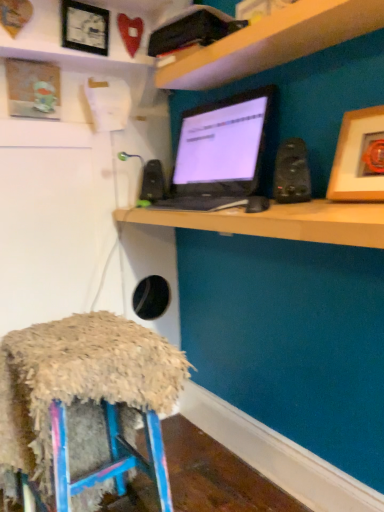
Identify the location of black glossy monitor at center. (279, 221).

This screenshot has height=512, width=384. Describe the element at coordinates (272, 42) in the screenshot. I see `wooden shelf at upper center` at that location.

Identify the location of wooden shelf at upper center. (272, 42).

Image resolution: width=384 pixels, height=512 pixels. What do you see at coordinates (220, 153) in the screenshot? I see `black glossy laptop at center` at bounding box center [220, 153].

The image size is (384, 512). What are the coordinates of `wooden framed picture at upper left, the 2th picture frame from the left` in the screenshot? It's located at (85, 27).

Does point (367, 141) come behind point (157, 183)?

No.

From the picture: Can you confirm if wooden picture frame at upper right, the 1th picture frame in the right-to-left sequence, is positioned to the right of black matte speaker at center, arranged as the first speaker when viewed from the back?

Correct, you'll find wooden picture frame at upper right, the 1th picture frame in the right-to-left sequence, to the right of black matte speaker at center, arranged as the first speaker when viewed from the back.

From the picture: Is wooden picture frame at upper right, which is the third picture frame from back to front, oriented towards black matte speaker at center, marked as the 1th speaker in a left-to-right arrangement?

No, wooden picture frame at upper right, which is the third picture frame from back to front, is not aimed at black matte speaker at center, marked as the 1th speaker in a left-to-right arrangement.

Is the depth of wooden picture frame at upper right, the 1th picture frame in the right-to-left sequence, greater than that of black matte speaker at center, arranged as the first speaker when viewed from the back?

No, wooden picture frame at upper right, the 1th picture frame in the right-to-left sequence, is in front of black matte speaker at center, arranged as the first speaker when viewed from the back.

From a real-world perspective, who is located higher, black plastic speaker at upper right, which ranks as the first speaker in front-to-back order, or matte green frame at upper left, the 1th picture frame from the back?

matte green frame at upper left, the 1th picture frame from the back, is physically above.

Is black plastic speaker at upper right, which ranks as the first speaker in front-to-back order, at the left side of matte green frame at upper left, the 2th picture frame when ordered from top to bottom?

In fact, black plastic speaker at upper right, which ranks as the first speaker in front-to-back order, is to the right of matte green frame at upper left, the 2th picture frame when ordered from top to bottom.

Between black plastic speaker at upper right, the 2th speaker when ordered from back to front, and matte green frame at upper left, marked as the first picture frame in a left-to-right arrangement, which one has larger size?

With larger size is matte green frame at upper left, marked as the first picture frame in a left-to-right arrangement.

Looking at this image, is wooden picture frame at upper right, the first picture frame positioned from the front, at the left side of black plastic speaker at upper right, the first speaker positioned from the right?

Incorrect, wooden picture frame at upper right, the first picture frame positioned from the front, is not on the left side of black plastic speaker at upper right, the first speaker positioned from the right.

From the image's perspective, which one is positioned lower, wooden picture frame at upper right, the 1th picture frame in the right-to-left sequence, or black plastic speaker at upper right, marked as the 2th speaker in a left-to-right arrangement?

black plastic speaker at upper right, marked as the 2th speaker in a left-to-right arrangement, is shown below in the image.

Is wooden picture frame at upper right, which is the first picture frame in bottom-to-top order, not close to black plastic speaker at upper right, which ranks as the first speaker in front-to-back order?

wooden picture frame at upper right, which is the first picture frame in bottom-to-top order, is actually quite close to black plastic speaker at upper right, which ranks as the first speaker in front-to-back order.

Can we say wooden picture frame at upper right, the first picture frame positioned from the front, lies outside black plastic speaker at upper right, which ranks as the first speaker in front-to-back order?

Yes.

From a real-world perspective, is wooden shelf at upper center physically located above or below matte green frame at upper left, the 1th picture frame from the back?

wooden shelf at upper center is situated higher than matte green frame at upper left, the 1th picture frame from the back, in the real world.

Is wooden shelf at upper center positioned with its back to matte green frame at upper left, marked as the first picture frame in a left-to-right arrangement?

No, wooden shelf at upper center is not facing away from matte green frame at upper left, marked as the first picture frame in a left-to-right arrangement.

Who is more distant, wooden shelf at upper center or matte green frame at upper left, the 2th picture frame when ordered from top to bottom?

Positioned behind is matte green frame at upper left, the 2th picture frame when ordered from top to bottom.

Is wooden shelf at upper center in contact with matte green frame at upper left, the 2th picture frame ordered from the bottom?

No, wooden shelf at upper center is not touching matte green frame at upper left, the 2th picture frame ordered from the bottom.

Which point is more forward, (150, 170) or (21, 81)?

The point (21, 81) is closer to the camera.

Is black matte speaker at center, which is the second speaker from front to back, in front of or behind matte green frame at upper left, the 2th picture frame when ordered from top to bottom, in the image?

black matte speaker at center, which is the second speaker from front to back, is positioned farther from the viewer than matte green frame at upper left, the 2th picture frame when ordered from top to bottom.

From their relative heights in the image, would you say black matte speaker at center, which is the second speaker from front to back, is taller or shorter than matte green frame at upper left, positioned as the third picture frame in right-to-left order?

In the image, black matte speaker at center, which is the second speaker from front to back, appears to be shorter than matte green frame at upper left, positioned as the third picture frame in right-to-left order.

Is black matte speaker at center, which is the second speaker from front to back, next to matte green frame at upper left, marked as the third picture frame in a front-to-back arrangement, and touching it?

No, black matte speaker at center, which is the second speaker from front to back, is not next to matte green frame at upper left, marked as the third picture frame in a front-to-back arrangement.

Can you confirm if matte green frame at upper left, the 2th picture frame ordered from the bottom, is bigger than black glossy laptop at center?

Incorrect, matte green frame at upper left, the 2th picture frame ordered from the bottom, is not larger than black glossy laptop at center.

From a real-world perspective, is matte green frame at upper left, the 1th picture frame from the back, on black glossy laptop at center?

Indeed, from a real-world perspective, matte green frame at upper left, the 1th picture frame from the back, stands above black glossy laptop at center.

Consider the image. Considering the positions of objects matte green frame at upper left, marked as the third picture frame in a front-to-back arrangement, and black glossy laptop at center in the image provided, who is behind, matte green frame at upper left, marked as the third picture frame in a front-to-back arrangement, or black glossy laptop at center?

matte green frame at upper left, marked as the third picture frame in a front-to-back arrangement, is further from the camera.

Based on the photo, is matte green frame at upper left, positioned as the third picture frame in right-to-left order, spatially inside black glossy laptop at center, or outside of it?

matte green frame at upper left, positioned as the third picture frame in right-to-left order, is spatially situated outside black glossy laptop at center.

From their relative heights in the image, would you say wooden framed picture at upper left, which is the second picture frame in back-to-front order, is taller or shorter than wooden picture frame at upper right, the first picture frame positioned from the front?

In the image, wooden framed picture at upper left, which is the second picture frame in back-to-front order, appears to be shorter than wooden picture frame at upper right, the first picture frame positioned from the front.

In the scene shown: Is wooden framed picture at upper left, the 2th picture frame from the right, not inside wooden picture frame at upper right, the first picture frame positioned from the front?

wooden framed picture at upper left, the 2th picture frame from the right, is positioned outside wooden picture frame at upper right, the first picture frame positioned from the front.

Is point (85, 39) closer to viewer compared to point (354, 193)?

That is False.

Considering the sizes of wooden framed picture at upper left, arranged as the 1th picture frame when viewed from the top, and wooden picture frame at upper right, which is the third picture frame from back to front, in the image, is wooden framed picture at upper left, arranged as the 1th picture frame when viewed from the top, wider or thinner than wooden picture frame at upper right, which is the third picture frame from back to front,?

Considering their sizes, wooden framed picture at upper left, arranged as the 1th picture frame when viewed from the top, looks slimmer than wooden picture frame at upper right, which is the third picture frame from back to front.

From the wooden picture frame at upper right, the 3th picture frame in the top-to-bottom sequence, count 2nd speakers backward and point to it. Please provide its 2D coordinates.

[(153, 182)]

From a real-world perspective, count 1st speakers downward from the matte green frame at upper left, marked as the third picture frame in a front-to-back arrangement, and point to it. Please provide its 2D coordinates.

[(292, 172)]

From the image, which object appears to be nearer to wooden framed picture at upper left, the 2th picture frame from the right, matte green frame at upper left, marked as the first picture frame in a left-to-right arrangement, or black glossy monitor at center?

Based on the image, matte green frame at upper left, marked as the first picture frame in a left-to-right arrangement, appears to be nearer to wooden framed picture at upper left, the 2th picture frame from the right.

From the image, which object appears to be farther from black glossy monitor at center, black matte speaker at center, which appears as the second speaker when viewed from the right, or wooden shelf at upper center?

black matte speaker at center, which appears as the second speaker when viewed from the right, is further to black glossy monitor at center.

When comparing their distances from matte green frame at upper left, marked as the third picture frame in a front-to-back arrangement, does black glossy monitor at center or black plastic speaker at upper right, the 2th speaker when ordered from back to front, seem closer?

black glossy monitor at center is positioned closer to the anchor matte green frame at upper left, marked as the third picture frame in a front-to-back arrangement.

When comparing their distances from wooden picture frame at upper right, the first picture frame positioned from the front, does wooden shelf at upper center or wooden framed picture at upper left, the 2th picture frame from the right, seem further?

wooden framed picture at upper left, the 2th picture frame from the right, is positioned further to the anchor wooden picture frame at upper right, the first picture frame positioned from the front.

From the image, which object appears to be farther from black glossy monitor at center, black glossy laptop at center or fuzzy fabric stool at lower left?

The object further to black glossy monitor at center is fuzzy fabric stool at lower left.

Which object lies further to the anchor point black plastic speaker at upper right, the 2th speaker when ordered from back to front, wooden picture frame at upper right, the third picture frame in the left-to-right sequence, or matte green frame at upper left, the 1th picture frame from the back?

The object further to black plastic speaker at upper right, the 2th speaker when ordered from back to front, is matte green frame at upper left, the 1th picture frame from the back.

Which object lies further to the anchor point black glossy laptop at center, matte green frame at upper left, marked as the first picture frame in a left-to-right arrangement, or fuzzy fabric stool at lower left?

fuzzy fabric stool at lower left is positioned further to the anchor black glossy laptop at center.

Considering their positions, is black plastic speaker at upper right, the 2th speaker when ordered from back to front, positioned closer to black glossy laptop at center than fuzzy fabric stool at lower left?

Based on the image, black plastic speaker at upper right, the 2th speaker when ordered from back to front, appears to be nearer to black glossy laptop at center.

Locate an element on the screen. The image size is (384, 512). speaker between wooden picture frame at upper right, the first picture frame positioned from the front, and black matte speaker at center, which appears as the second speaker when viewed from the right, along the z-axis is located at coordinates (292, 172).

The image size is (384, 512). Identify the location of picture frame between matte green frame at upper left, marked as the first picture frame in a left-to-right arrangement, and wooden picture frame at upper right, the third picture frame in the left-to-right sequence, in the horizontal direction. click(x=85, y=27).

Identify the location of speaker between black matte speaker at center, which is the second speaker from front to back, and fuzzy fabric stool at lower left vertically. (292, 172).

This screenshot has width=384, height=512. What are the coordinates of `speaker positioned between wooden shelf at upper center and black matte speaker at center, which is the second speaker from front to back, from near to far` in the screenshot? It's located at (292, 172).